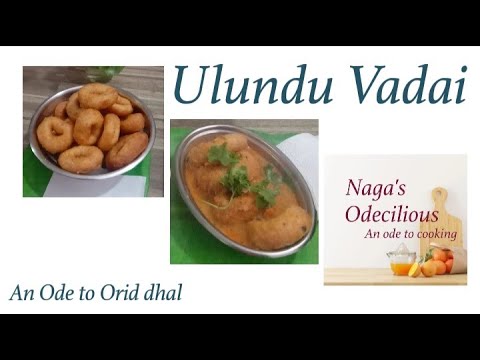
The image size is (480, 360). What are the coordinates of `bowl` in the screenshot? It's located at (129, 166).